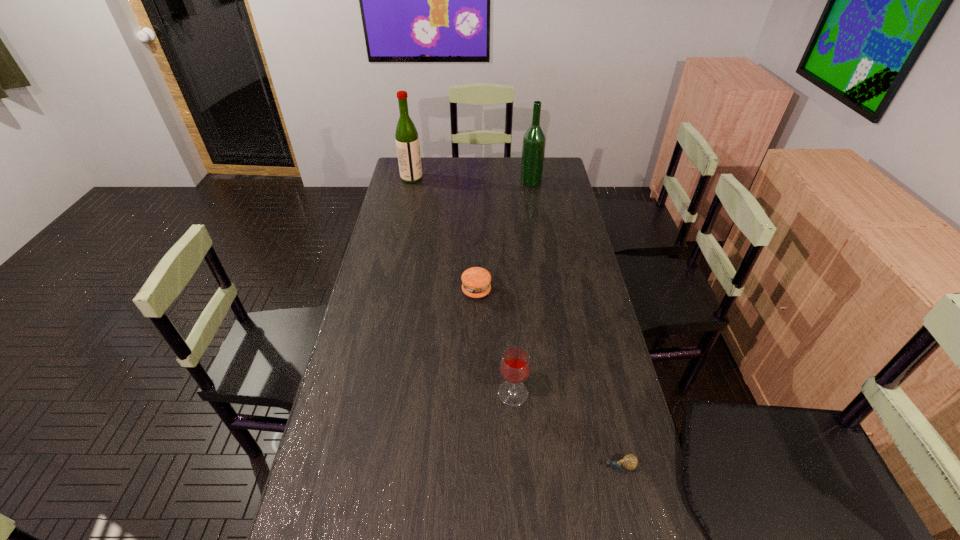
Where is `vacant area that lies between the alcohol and the second nearest object`? The height and width of the screenshot is (540, 960). vacant area that lies between the alcohol and the second nearest object is located at coordinates (522, 287).

Where is `unoccupied position between the fourth object from right to left and the liquor`? unoccupied position between the fourth object from right to left and the liquor is located at coordinates (444, 235).

Select which object is the third closest to the second object from left to right. Please provide its 2D coordinates. Your answer should be formatted as a tuple, i.e. [(x, y)], where the tuple contains the x and y coordinates of a point satisfying the conditions above.

[(534, 140)]

Locate an element on the screen. The image size is (960, 540). object that can be found as the third closest to the leftmost object is located at coordinates (515, 365).

You are a GUI agent. You are given a task and a screenshot of the screen. Output one action in this format:
    pyautogui.click(x=<x>, y=<y>)
    Task: Click on the vacant space that satisfies the following two spatial constraints: 1. on the back side of the alcohol; 2. on the left side of the fourth farthest object
    The height and width of the screenshot is (540, 960).
    Given the screenshot: What is the action you would take?
    pyautogui.click(x=500, y=181)

At what (x,y) coordinates should I click in order to perform the action: click on vacant position in the image that satisfies the following two spatial constraints: 1. on the label of the third object from left to right; 2. on the right side of the leftmost object. Please return your answer as a coordinate pair (x, y). The height and width of the screenshot is (540, 960). Looking at the image, I should click on (365, 393).

Find the location of `free space that satisfies the following two spatial constraints: 1. on the back side of the third object from right to left; 2. on the left side of the alcohol`. free space that satisfies the following two spatial constraints: 1. on the back side of the third object from right to left; 2. on the left side of the alcohol is located at coordinates (500, 181).

You are a GUI agent. You are given a task and a screenshot of the screen. Output one action in this format:
    pyautogui.click(x=<x>, y=<y>)
    Task: Click on the free space that satisfies the following two spatial constraints: 1. on the back side of the third farthest object; 2. on the left side of the alcohol
    The image size is (960, 540).
    Given the screenshot: What is the action you would take?
    pyautogui.click(x=477, y=181)

You are a GUI agent. You are given a task and a screenshot of the screen. Output one action in this format:
    pyautogui.click(x=<x>, y=<y>)
    Task: Click on the vacant space that satisfies the following two spatial constraints: 1. on the back side of the third nearest object; 2. on the label of the leftmost object
    This screenshot has width=960, height=540.
    Given the screenshot: What is the action you would take?
    pyautogui.click(x=477, y=179)

Identify the location of blank space that satisfies the following two spatial constraints: 1. on the label of the third object from left to right; 2. on the left side of the leftmost object. (365, 393).